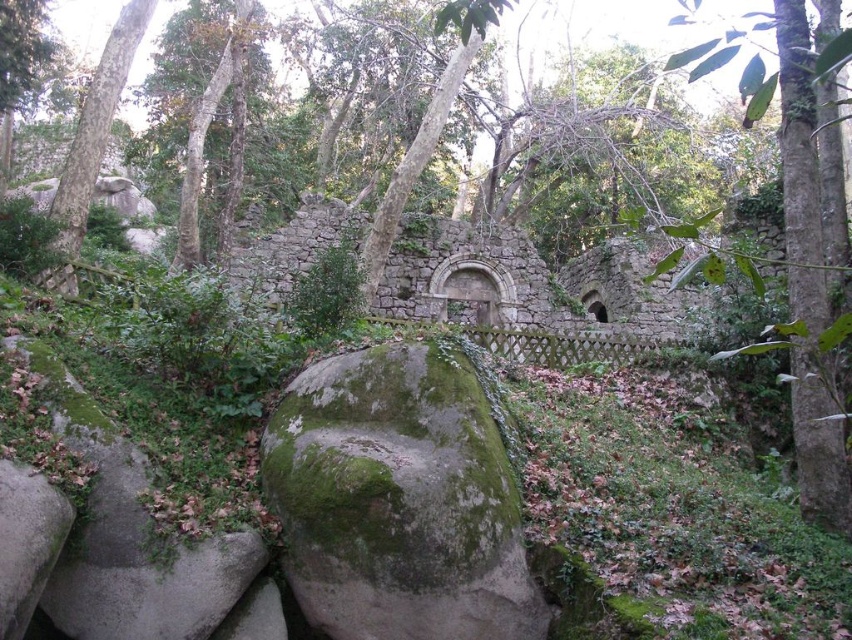
Question: Can you confirm if green mossy rock at center is wider than green mossy rock at left?

Choices:
 (A) yes
 (B) no

Answer: (B)

Question: Which object is farther from the camera taking this photo?

Choices:
 (A) green mossy rock at left
 (B) green mossy rock at center

Answer: (A)

Question: Does green mossy rock at center appear on the left side of green mossy rock at left?

Choices:
 (A) no
 (B) yes

Answer: (A)

Question: Among these points, which one is nearest to the camera?

Choices:
 (A) (119, 52)
 (B) (488, 481)

Answer: (B)

Question: Which object is closer to the camera taking this photo?

Choices:
 (A) green mossy rock at center
 (B) green mossy rock at left

Answer: (A)

Question: Does green mossy rock at center come behind green mossy rock at left?

Choices:
 (A) no
 (B) yes

Answer: (A)